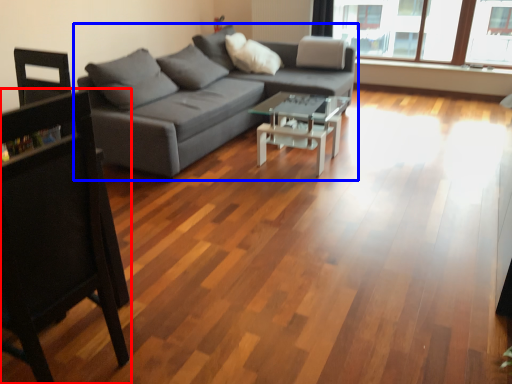
Question: Among these objects, which one is nearest to the camera, chair (highlighted by a red box) or studio couch (highlighted by a blue box)?

Choices:
 (A) chair
 (B) studio couch

Answer: (A)